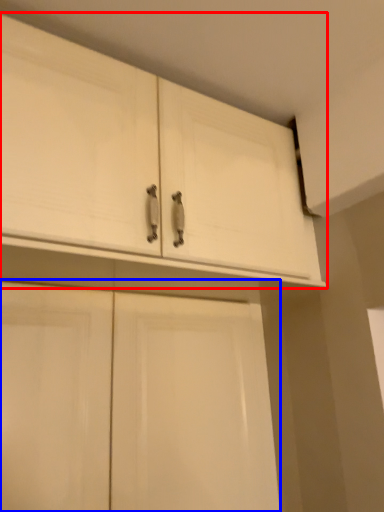
Question: Which of the following is the farthest to the observer, cabinetry (highlighted by a red box) or cabinetry (highlighted by a blue box)?

Choices:
 (A) cabinetry
 (B) cabinetry

Answer: (B)